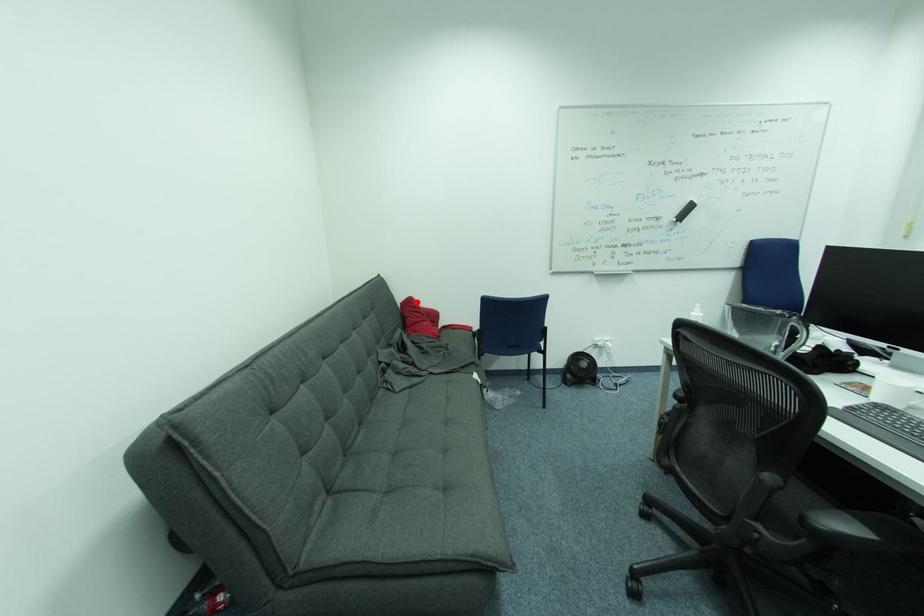
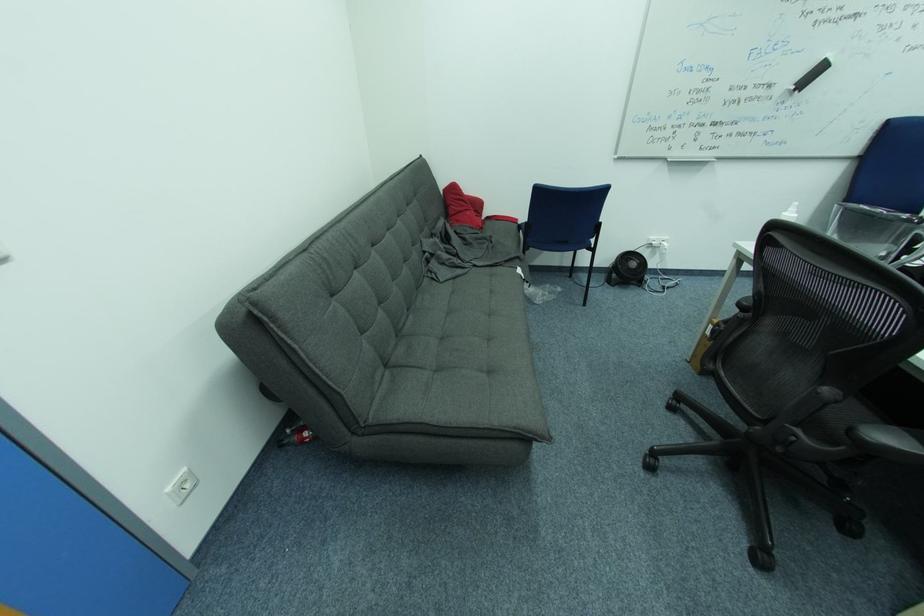
Find the pixel in the second image that matches the highlighted location in the first image.

(459, 188)